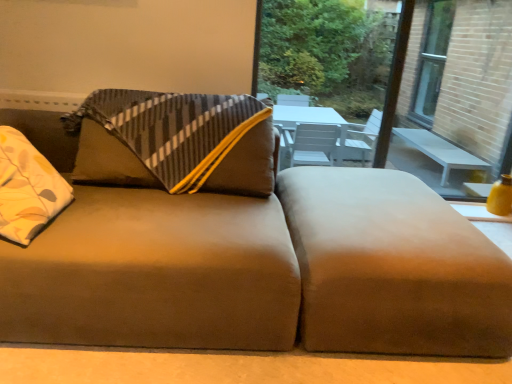
Question: Would you say suede-like brown footrest at lower right contains transparent glass window at upper right?

Choices:
 (A) yes
 (B) no

Answer: (B)

Question: Is suede-like brown footrest at lower right positioned before transparent glass window at upper right?

Choices:
 (A) yes
 (B) no

Answer: (A)

Question: Does suede-like brown footrest at lower right have a larger size compared to transparent glass window at upper right?

Choices:
 (A) no
 (B) yes

Answer: (B)

Question: From the image's perspective, is suede-like brown footrest at lower right located above transparent glass window at upper right?

Choices:
 (A) yes
 (B) no

Answer: (B)

Question: Is suede-like brown footrest at lower right at the right side of transparent glass window at upper right?

Choices:
 (A) no
 (B) yes

Answer: (B)

Question: Is point (344, 72) closer or farther from the camera than point (309, 294)?

Choices:
 (A) farther
 (B) closer

Answer: (A)

Question: In terms of size, does transparent glass window at upper right appear bigger or smaller than suede-like brown footrest at lower right?

Choices:
 (A) big
 (B) small

Answer: (B)

Question: Is transparent glass window at upper right inside or outside of suede-like brown footrest at lower right?

Choices:
 (A) inside
 (B) outside

Answer: (B)

Question: Based on their positions, is transparent glass window at upper right located to the left or right of suede-like brown footrest at lower right?

Choices:
 (A) right
 (B) left

Answer: (B)

Question: Based on their positions, is suede brown couch at center located to the left or right of transparent glass window at upper right?

Choices:
 (A) right
 (B) left

Answer: (B)

Question: In terms of width, does suede brown couch at center look wider or thinner when compared to transparent glass window at upper right?

Choices:
 (A) wide
 (B) thin

Answer: (A)

Question: From a real-world perspective, is suede brown couch at center above or below transparent glass window at upper right?

Choices:
 (A) above
 (B) below

Answer: (B)

Question: Is suede brown couch at center bigger or smaller than transparent glass window at upper right?

Choices:
 (A) big
 (B) small

Answer: (A)

Question: Is point (258, 8) positioned closer to the camera than point (200, 117)?

Choices:
 (A) farther
 (B) closer

Answer: (A)

Question: Considering the relative positions of transparent glass window at upper right and suede brown couch at center in the image provided, is transparent glass window at upper right to the left or to the right of suede brown couch at center?

Choices:
 (A) left
 (B) right

Answer: (B)